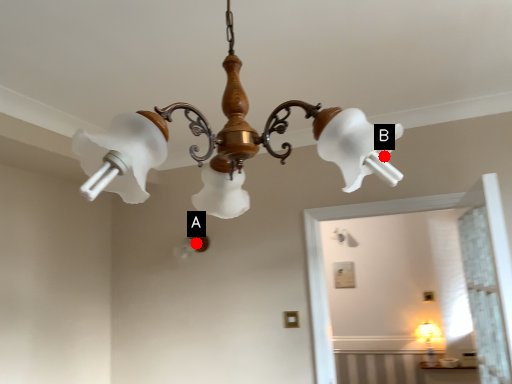
Question: Two points are circled on the image, labeled by A and B beside each circle. Which point appears closest to the camera in this image?

Choices:
 (A) A is closer
 (B) B is closer

Answer: (B)